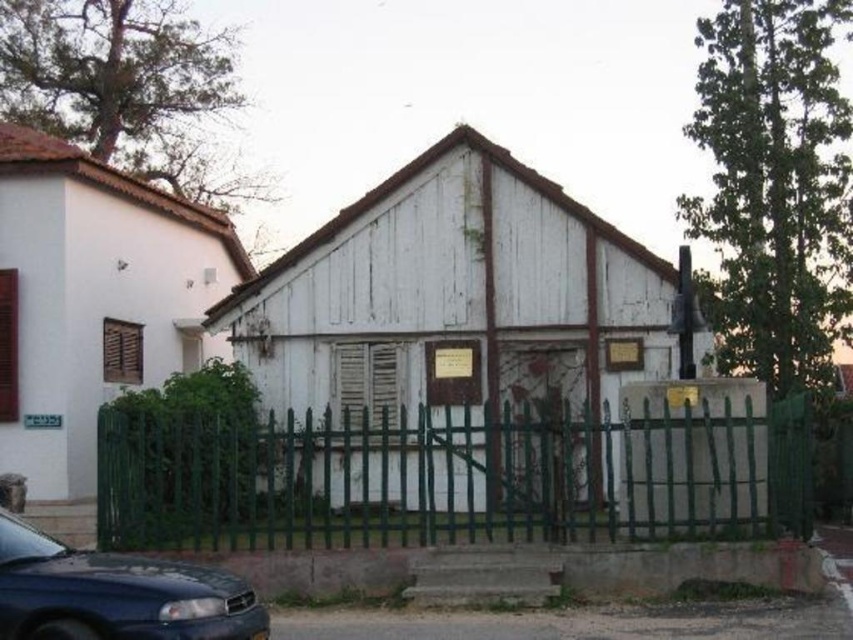
You are standing in front of the small white building with a triangular roof. You need to access the plaque mentioned on the wall. Can you reach the plaque without going through the green metal fence at center?

The green metal fence at center is located at point (450, 477), which blocks the direct path to the plaque. Therefore, you would need to go through or around the green metal fence at center to reach the plaque.

You are standing in front of the small white building and want to enter. The green metal fence at center and the shiny blue sedan at lower left are blocking your path. Which object is closer to the ground and thus easier to step over?

The green metal fence at center is below shiny blue sedan at lower left, so the green metal fence at center is closer to the ground and easier to step over.